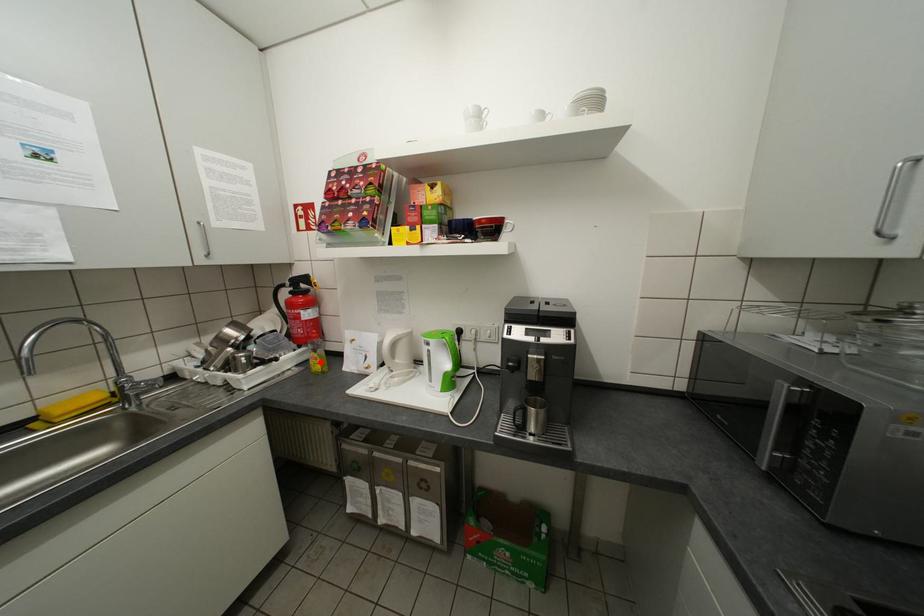
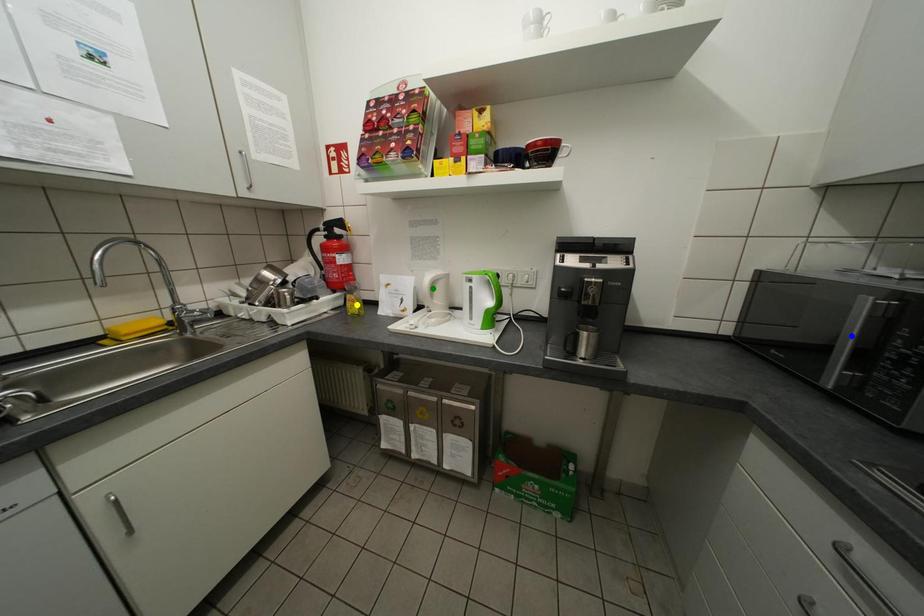
Question: I am providing you with two images of the same scene from different viewpoints. A red point is marked on the first image. You are given multiple points on the second image. Which mark in image 2 goes with the point in image 1?

Choices:
 (A) green point
 (B) yellow point
 (C) blue point

Answer: (B)